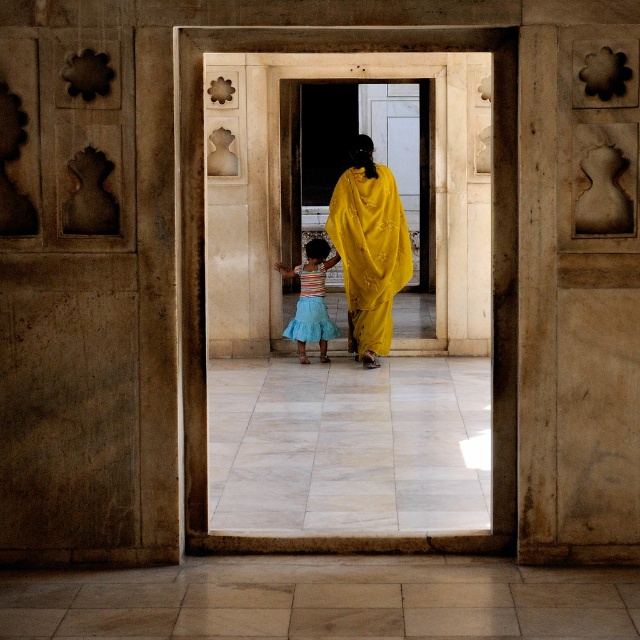
You are standing in front of the doorway and see both the yellow satin sari at center and the blue tulle skirt at center. From your perspective, which one is positioned more to the right?

The yellow satin sari at center is positioned more to the right compared to the blue tulle skirt at center.

You are a photographer standing outside the grand doorway. You want to take a photo of the yellow satin sari at center and the blue tulle skirt at center. Which one will appear taller in the photo?

The yellow satin sari at center will appear taller in the photo because it is taller than the blue tulle skirt at center according to the description.